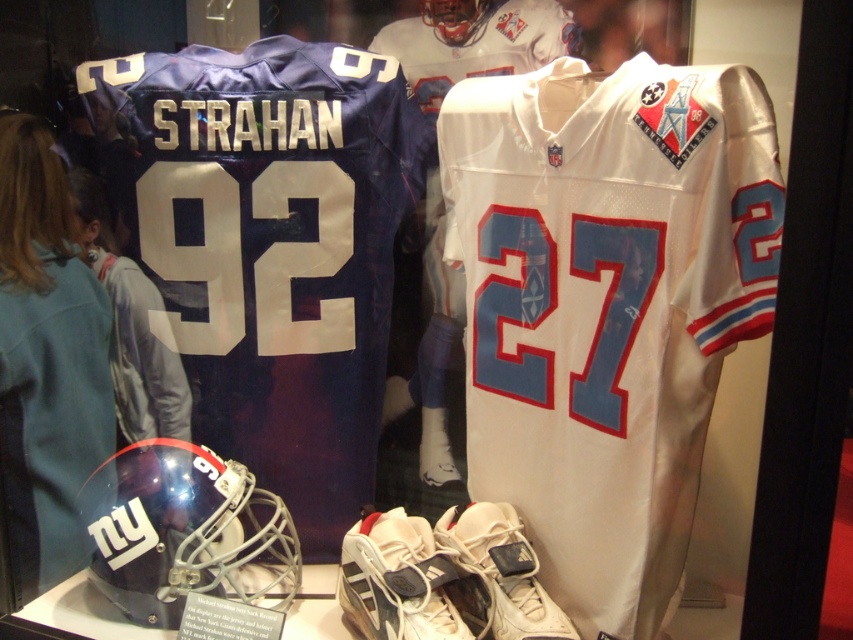
Can you confirm if white mesh jersey at center is wider than matte blue jersey at upper center?

Yes, white mesh jersey at center is wider than matte blue jersey at upper center.

Between point (553, 436) and point (338, 54), which one is positioned behind?

The point (338, 54) is behind.

This screenshot has width=853, height=640. I want to click on white mesh jersey at center, so click(x=606, y=305).

Find the location of a particular element. white mesh jersey at center is located at coordinates (606, 305).

Is white fabric at center shorter than matte blue jersey at upper center?

No, white fabric at center is not shorter than matte blue jersey at upper center.

Who is taller, white fabric at center or matte blue jersey at upper center?

white fabric at center is taller.

You are a GUI agent. You are given a task and a screenshot of the screen. Output one action in this format:
    pyautogui.click(x=<x>, y=<y>)
    Task: Click on the white fabric at center
    The image size is (853, 640).
    Given the screenshot: What is the action you would take?
    pyautogui.click(x=194, y=252)

Is point (572, 310) positioned before point (167, 337)?

That is True.

Which of these two, white mesh jersey at center or white fabric at center, stands taller?

Standing taller between the two is white mesh jersey at center.

Between point (548, 332) and point (140, 248), which one is positioned behind?

Positioned behind is point (140, 248).

Locate an element on the screen. The height and width of the screenshot is (640, 853). white mesh jersey at center is located at coordinates (606, 305).